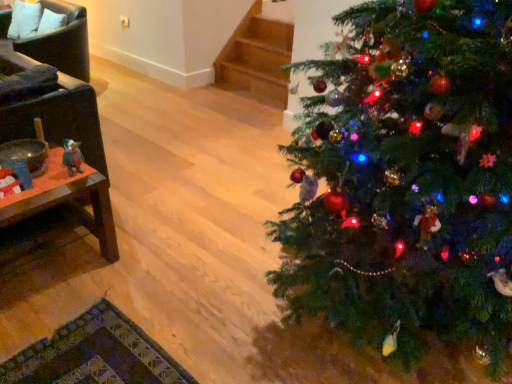
This screenshot has height=384, width=512. I want to click on vacant space in woodenmaterial/texturetable at left (from a real-world perspective), so click(42, 266).